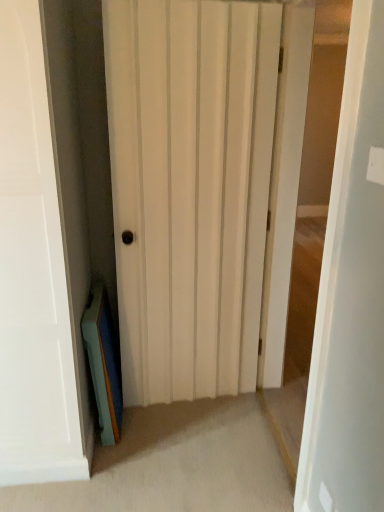
Locate an element on the screen. The height and width of the screenshot is (512, 384). white matte door at center, the second door viewed from the right is located at coordinates (190, 189).

At what (x,y) coordinates should I click in order to perform the action: click on teal matte book at lower left. Please return your answer as a coordinate pair (x, y). Looking at the image, I should click on (103, 364).

Which of these two, white matte door at center, the 1th door in the left-to-right sequence, or white wood door at center, the second door viewed from the left, is smaller?

white matte door at center, the 1th door in the left-to-right sequence.

Does white matte door at center, the second door viewed from the right, contain white wood door at center, the second door viewed from the left?

No.

How different are the orientations of white matte door at center, the 1th door in the left-to-right sequence, and white wood door at center, the 1th door when ordered from right to left, in degrees?

The angular difference between white matte door at center, the 1th door in the left-to-right sequence, and white wood door at center, the 1th door when ordered from right to left, is 94.6 degrees.

Is white matte door at center, the second door viewed from the right, taller than white wood door at center, the 1th door when ordered from right to left?

Incorrect, the height of white matte door at center, the second door viewed from the right, is not larger of that of white wood door at center, the 1th door when ordered from right to left.

Is white wood door at center, the 1th door when ordered from right to left, looking in the opposite direction of teal matte book at lower left?

No, white wood door at center, the 1th door when ordered from right to left, is not facing away from teal matte book at lower left.

Could you measure the distance between white wood door at center, the second door viewed from the left, and teal matte book at lower left?

3.61 feet.

Can you tell me how much white wood door at center, the 1th door when ordered from right to left, and teal matte book at lower left differ in facing direction?

180 degrees.

Is white wood door at center, the second door viewed from the left, positioned beyond the bounds of teal matte book at lower left?

Yes, white wood door at center, the second door viewed from the left, is located beyond the bounds of teal matte book at lower left.

Is point (87, 337) farther from viewer compared to point (246, 367)?

No, it is not.

From the image's perspective, between teal matte book at lower left and white matte door at center, the 1th door in the left-to-right sequence, which one is located above?

white matte door at center, the 1th door in the left-to-right sequence, from the image's perspective.

Is teal matte book at lower left looking in the opposite direction of white matte door at center, the 1th door in the left-to-right sequence?

teal matte book at lower left is not turned away from white matte door at center, the 1th door in the left-to-right sequence.

Does teal matte book at lower left have a greater height compared to white matte door at center, the 1th door in the left-to-right sequence?

In fact, teal matte book at lower left may be shorter than white matte door at center, the 1th door in the left-to-right sequence.

Would you say white wood door at center, the 1th door when ordered from right to left, is part of teal matte book at lower left's contents?

No, white wood door at center, the 1th door when ordered from right to left, is not inside teal matte book at lower left.

How many degrees apart are the facing directions of teal matte book at lower left and white wood door at center, the second door viewed from the left?

teal matte book at lower left and white wood door at center, the second door viewed from the left, are facing 180 degrees away from each other.

From a real-world perspective, which object stands above the other?

In real-world perspective, white wood door at center, the 1th door when ordered from right to left, is above.

From the image's perspective, would you say white wood door at center, the 1th door when ordered from right to left, is positioned over white matte door at center, the second door viewed from the right?

No, from the image's perspective, white wood door at center, the 1th door when ordered from right to left, is not over white matte door at center, the second door viewed from the right.

Is white wood door at center, the second door viewed from the left, next to white matte door at center, the 1th door in the left-to-right sequence, and touching it?

white wood door at center, the second door viewed from the left, is not next to white matte door at center, the 1th door in the left-to-right sequence, and they're not touching.

Who is taller, white wood door at center, the 1th door when ordered from right to left, or white matte door at center, the second door viewed from the right?

Standing taller between the two is white wood door at center, the 1th door when ordered from right to left.

In the scene shown: Considering the relative positions of white matte door at center, the second door viewed from the right, and teal matte book at lower left in the image provided, is white matte door at center, the second door viewed from the right, behind teal matte book at lower left?

No, it is in front of teal matte book at lower left.

Where is `book lying below the white matte door at center, the second door viewed from the right (from the image's perspective)`? book lying below the white matte door at center, the second door viewed from the right (from the image's perspective) is located at coordinates (103, 364).

Is white matte door at center, the 1th door in the left-to-right sequence, turned away from teal matte book at lower left?

No, white matte door at center, the 1th door in the left-to-right sequence,'s orientation is not away from teal matte book at lower left.

From a real-world perspective, is white matte door at center, the 1th door in the left-to-right sequence, physically below teal matte book at lower left?

Incorrect, from a real-world perspective, white matte door at center, the 1th door in the left-to-right sequence, is higher than teal matte book at lower left.

This screenshot has width=384, height=512. Find the location of `door in front of the white matte door at center, the second door viewed from the right`. door in front of the white matte door at center, the second door viewed from the right is located at coordinates (351, 297).

Where is `book located on the left of white wood door at center, the 1th door when ordered from right to left`? This screenshot has width=384, height=512. book located on the left of white wood door at center, the 1th door when ordered from right to left is located at coordinates (103, 364).

In the scene shown: When comparing their distances from white wood door at center, the second door viewed from the left, does white matte door at center, the 1th door in the left-to-right sequence, or teal matte book at lower left seem further?

teal matte book at lower left is positioned further to the anchor white wood door at center, the second door viewed from the left.

Based on their spatial positions, is teal matte book at lower left or white matte door at center, the second door viewed from the right, further from white wood door at center, the 1th door when ordered from right to left?

teal matte book at lower left.

Considering their positions, is white wood door at center, the second door viewed from the left, positioned closer to teal matte book at lower left than white matte door at center, the second door viewed from the right?

The object closer to teal matte book at lower left is white matte door at center, the second door viewed from the right.

Looking at the image, which one is located further to white matte door at center, the 1th door in the left-to-right sequence, white wood door at center, the second door viewed from the left, or teal matte book at lower left?

Among the two, white wood door at center, the second door viewed from the left, is located further to white matte door at center, the 1th door in the left-to-right sequence.

Estimate the real-world distances between objects in this image. Which object is closer to white matte door at center, the second door viewed from the right, teal matte book at lower left or white wood door at center, the 1th door when ordered from right to left?

teal matte book at lower left is positioned closer to the anchor white matte door at center, the second door viewed from the right.

Which object lies nearer to the anchor point teal matte book at lower left, white matte door at center, the 1th door in the left-to-right sequence, or white wood door at center, the second door viewed from the left?

Among the two, white matte door at center, the 1th door in the left-to-right sequence, is located nearer to teal matte book at lower left.

In order to click on door situated between teal matte book at lower left and white wood door at center, the second door viewed from the left, from left to right in this screenshot , I will do `click(190, 189)`.